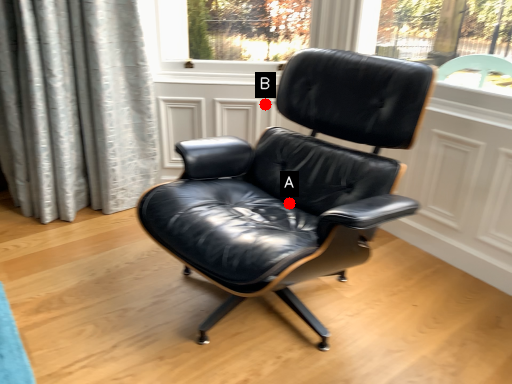
Question: Two points are circled on the image, labeled by A and B beside each circle. Which point appears farthest from the camera in this image?

Choices:
 (A) A is further
 (B) B is further

Answer: (B)